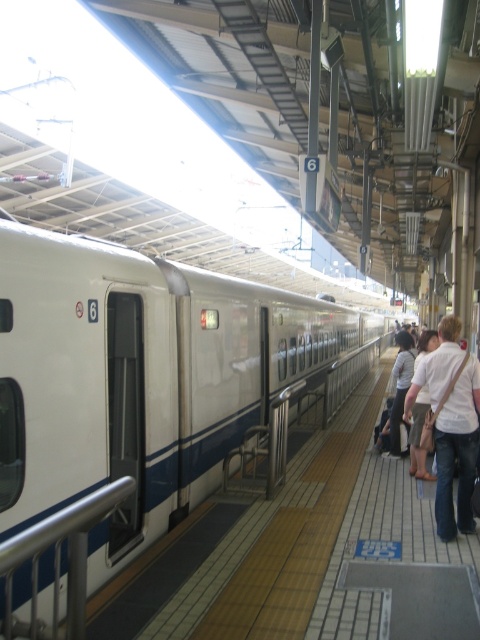
You are standing on the train platform and see the silver metallic rail at lower left and the white cotton shirt at right. Which object is closer to your left side?

The silver metallic rail at lower left is closer to your left side because it is positioned to the left of the white cotton shirt at right.

You are a maintenance worker needing to inspect the white glossy train at center and the silver metallic rail at lower left. Which object requires a ladder to reach its top for inspection?

The white glossy train at center requires a ladder to reach its top for inspection since it is taller than the silver metallic rail at lower left.

You are a person standing at the silver metallic rail at lower left and want to reach the white cotton shirt at right. The train is about to depart in 2 minutes. Can you make it in time if you walk at a normal pace?

The distance between the silver metallic rail at lower left and the white cotton shirt at right is 11.78 feet. Walking at a normal pace of about 3 feet per second, it would take approximately 4 seconds to cover that distance. Since the train departs in 2 minutes, which is 120 seconds, there is ample time to reach the white cotton shirt at right before the train leaves.